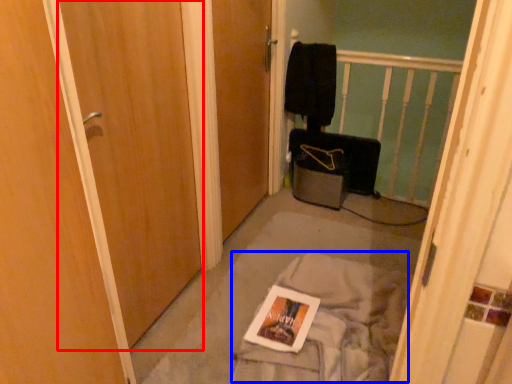
Question: Which object appears closest to the camera in this image, door (highlighted by a red box) or trim (highlighted by a blue box)?

Choices:
 (A) door
 (B) trim

Answer: (A)